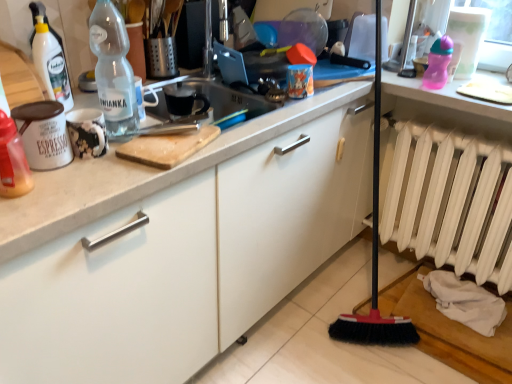
Question: From the image's perspective, would you say white matte radiator at lower right is positioned over translucent plastic bottle at left, which appears as the 2th bottle when viewed from the back?

Choices:
 (A) yes
 (B) no

Answer: (B)

Question: Is the position of white matte radiator at lower right less distant than that of translucent plastic bottle at left, arranged as the 2th bottle when viewed from the right?

Choices:
 (A) yes
 (B) no

Answer: (B)

Question: From a real-world perspective, is white matte radiator at lower right over translucent plastic bottle at left, which is the 1th bottle from left to right?

Choices:
 (A) yes
 (B) no

Answer: (B)

Question: From the image's perspective, is white matte radiator at lower right below translucent plastic bottle at left, which is the 1th bottle from left to right?

Choices:
 (A) no
 (B) yes

Answer: (B)

Question: Is white matte radiator at lower right positioned beyond the bounds of translucent plastic bottle at left, which appears as the 2th bottle when viewed from the back?

Choices:
 (A) yes
 (B) no

Answer: (A)

Question: Can you confirm if white matte radiator at lower right is wider than translucent plastic bottle at left, the first bottle when ordered from front to back?

Choices:
 (A) no
 (B) yes

Answer: (B)

Question: Is translucent plastic bottle at left, arranged as the 2th bottle when viewed from the right, looking in the opposite direction of transparent plastic bottle at upper left, positioned as the 2th bottle in bottom-to-top order?

Choices:
 (A) yes
 (B) no

Answer: (B)

Question: Is translucent plastic bottle at left, which is the 1th bottle from left to right, next to transparent plastic bottle at upper left, positioned as the 2th bottle in bottom-to-top order, and touching it?

Choices:
 (A) yes
 (B) no

Answer: (B)

Question: Can you confirm if translucent plastic bottle at left, arranged as the 2th bottle when viewed from the right, is bigger than transparent plastic bottle at upper left, marked as the 1th bottle in a back-to-front arrangement?

Choices:
 (A) yes
 (B) no

Answer: (B)

Question: Is transparent plastic bottle at upper left, which is the 1th bottle in top-to-bottom order, surrounded by translucent plastic bottle at left, acting as the second bottle starting from the top?

Choices:
 (A) no
 (B) yes

Answer: (A)

Question: From the image's perspective, is translucent plastic bottle at left, arranged as the 2th bottle when viewed from the right, below transparent plastic bottle at upper left, which is the 1th bottle in top-to-bottom order?

Choices:
 (A) no
 (B) yes

Answer: (B)

Question: Is translucent plastic bottle at left, the first bottle ordered from the bottom, positioned in front of transparent plastic bottle at upper left, which is the 1th bottle in top-to-bottom order?

Choices:
 (A) yes
 (B) no

Answer: (A)

Question: From a real-world perspective, does translucent plastic bottle at left, which is the 1th bottle from left to right, stand above white matte radiator at lower right?

Choices:
 (A) yes
 (B) no

Answer: (A)